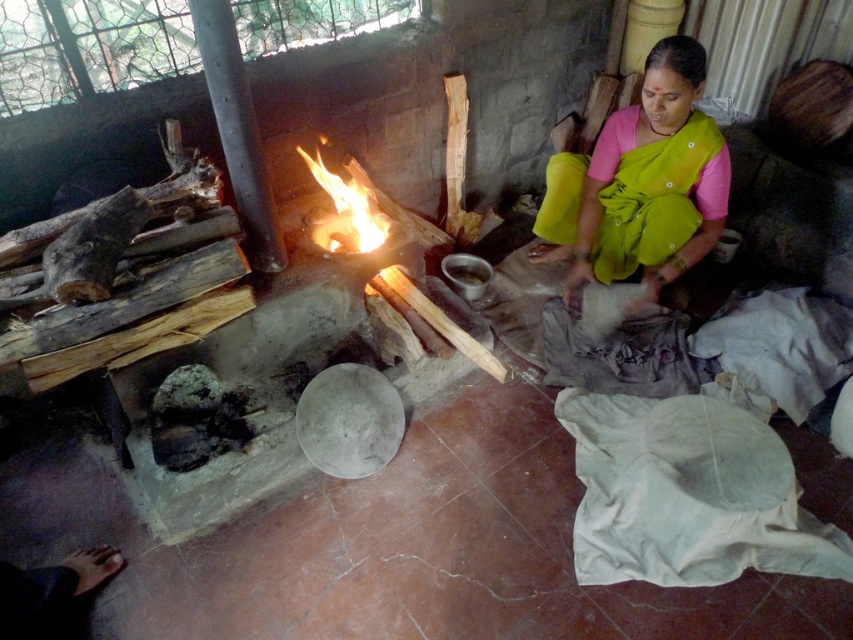
Who is shorter, green fabric sari at center or flamewoodfire at center?

Standing shorter between the two is flamewoodfire at center.

Can you confirm if green fabric sari at center is positioned to the left of flamewoodfire at center?

No, green fabric sari at center is not to the left of flamewoodfire at center.

This screenshot has height=640, width=853. What are the coordinates of `green fabric sari at center` in the screenshot? It's located at (641, 182).

Locate an element on the screen. green fabric sari at center is located at coordinates (641, 182).